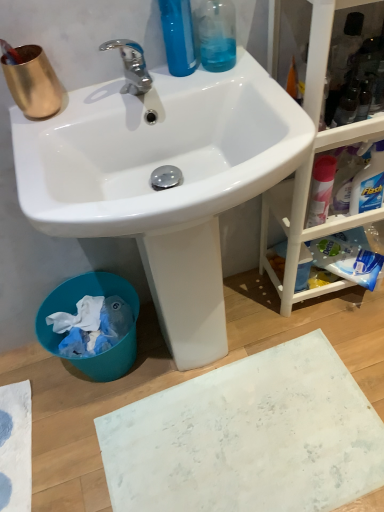
The image size is (384, 512). In order to click on vacant space to the right of chrome metallic faucet at upper center in this screenshot , I will do `click(210, 81)`.